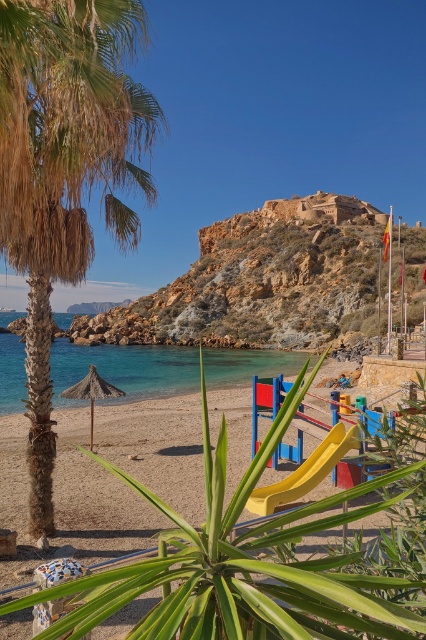
Which is more to the right, green leafy palm tree at left or yellow plastic slide at center?

Positioned to the right is yellow plastic slide at center.

Between green leafy palm tree at left and yellow plastic slide at center, which one has less height?

yellow plastic slide at center is shorter.

Which is behind, point (13, 51) or point (270, 500)?

The point (270, 500) is more distant.

Identify the location of green leafy palm tree at left. Image resolution: width=426 pixels, height=640 pixels. (65, 170).

Which is more to the right, yellow plastic slide at center or natural straw umbrella at center?

yellow plastic slide at center is more to the right.

Is point (258, 500) positioned in front of point (97, 387)?

Yes.

Find the location of `yellow plastic slide at center`. yellow plastic slide at center is located at coordinates (305, 472).

In the scene shown: Is clear blue water at center above yellow plastic slide at center?

Incorrect, clear blue water at center is not positioned above yellow plastic slide at center.

Who is more distant from viewer, (282, 360) or (322, 452)?

Positioned behind is point (282, 360).

The width and height of the screenshot is (426, 640). Describe the element at coordinates (126, 369) in the screenshot. I see `clear blue water at center` at that location.

What are the coordinates of `clear blue water at center` in the screenshot? It's located at (126, 369).